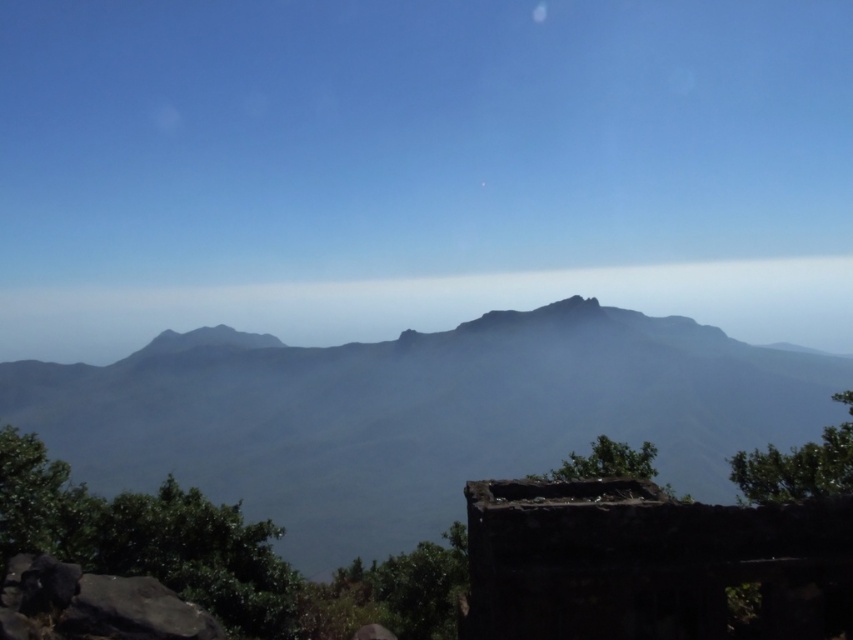
Where is `dark green textured mountain range at center`? dark green textured mountain range at center is located at coordinates (416, 416).

Between point (224, 340) and point (529, 285), which one is positioned behind?

The point (529, 285) is more distant.

Locate an element on the screen. Image resolution: width=853 pixels, height=640 pixels. dark green textured mountain range at center is located at coordinates (416, 416).